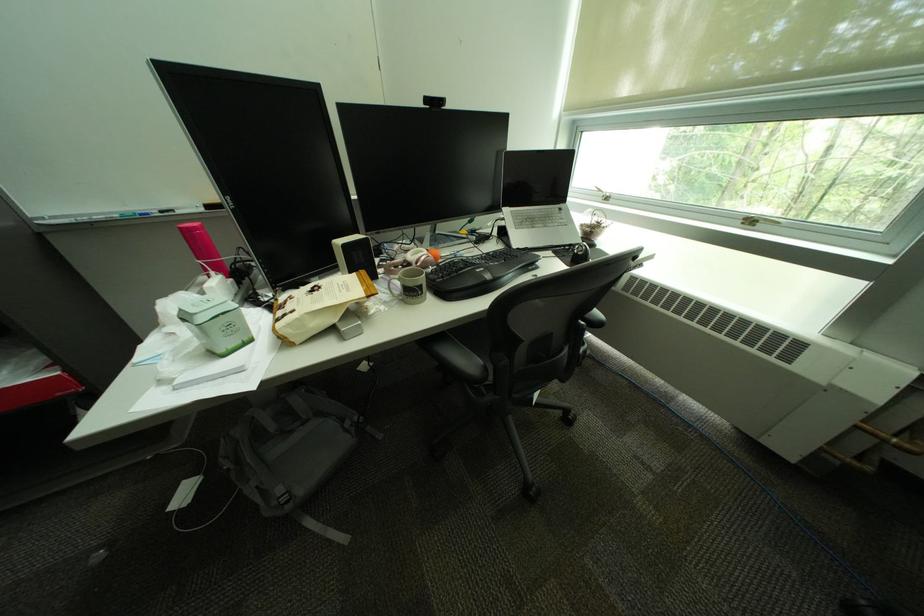
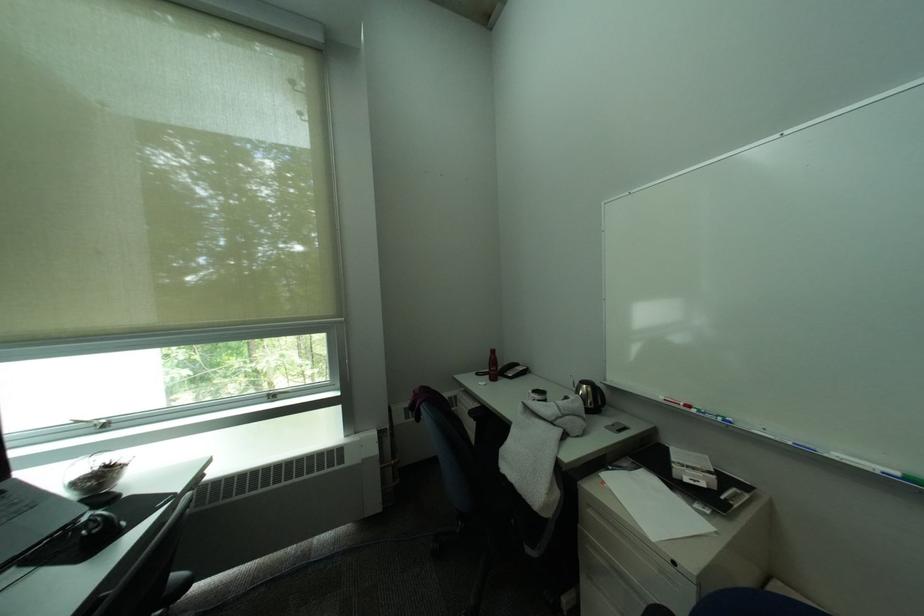
Question: Based on the continuous images, in which direction is the camera rotating? Reply with the corresponding letter.

Choices:
 (A) Left
 (B) Right
 (C) Up
 (D) Down

Answer: (B)